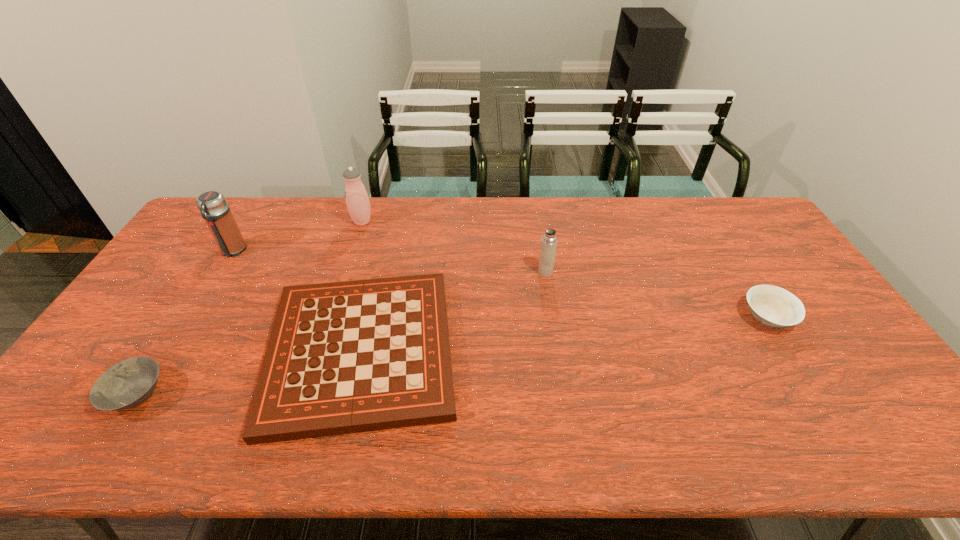
Locate an element on the screen. This screenshot has width=960, height=540. free space located 0.270m on the front of the farthest thermos bottle is located at coordinates (343, 282).

The height and width of the screenshot is (540, 960). Find the location of `blank space located 0.280m with a handle on the side of the fifth nearest object`. blank space located 0.280m with a handle on the side of the fifth nearest object is located at coordinates pyautogui.click(x=185, y=328).

Identify the location of free space located on the left of the fourth nearest object. (513, 272).

Find the location of `vacant region located 0.380m on the left of the right bowl`. vacant region located 0.380m on the left of the right bowl is located at coordinates (607, 318).

Find the location of a particular element. This screenshot has height=540, width=960. vacant space located 0.280m on the right of the left bowl is located at coordinates (281, 394).

Image resolution: width=960 pixels, height=540 pixels. What are the coordinates of `free space located on the back of the gameboard` in the screenshot? It's located at (390, 233).

The height and width of the screenshot is (540, 960). In order to click on object that is at the far edge in this screenshot , I will do `click(357, 200)`.

Identify the location of bowl at the near edge. Image resolution: width=960 pixels, height=540 pixels. (127, 384).

Identify the location of gameboard that is positioned at the near edge. This screenshot has width=960, height=540. (345, 357).

You are a GUI agent. You are given a task and a screenshot of the screen. Output one action in this format:
    pyautogui.click(x=<x>, y=<y>)
    Task: Click on the thermos bottle at the left edge
    This screenshot has width=960, height=540.
    Given the screenshot: What is the action you would take?
    pyautogui.click(x=213, y=206)